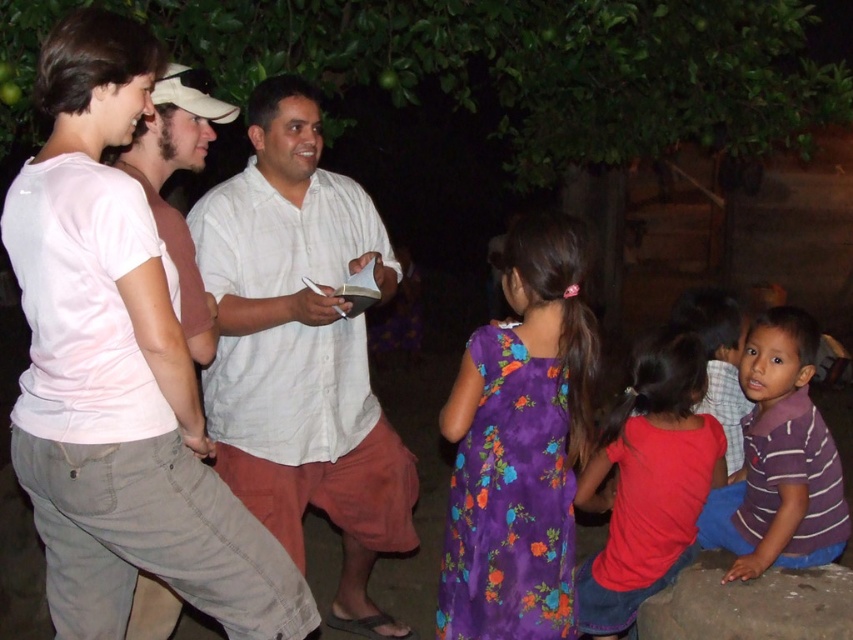
Based on the photo, you are a photographer standing at the edge of the gathering. You want to take a photo that includes both the white linen shirt at center and the red cotton shirt at lower right. Considering their heights, which shirt will appear larger in the photo?

The white linen shirt at center will appear larger in the photo because it is much taller than the red cotton shirt at lower right.

You are standing in the middle of the gathering and want to take a photo of both the point at [804,401] and the point at [144,614]. Which point should you focus on first to ensure both are in focus?

You should focus on the point at [804,401] first because it is closer to the camera than the point at [144,614]. By focusing on the closer point, the farther point will also be in focus due to the depth of field.

You are organizing a clothing donation drive and need to categorize shirts based on their size. You have a white linen shirt at center and a red cotton shirt at lower right. Which shirt should you place in the large size bin?

The white linen shirt at center should be placed in the large size bin because its width is larger than the red cotton shirt at lower right.